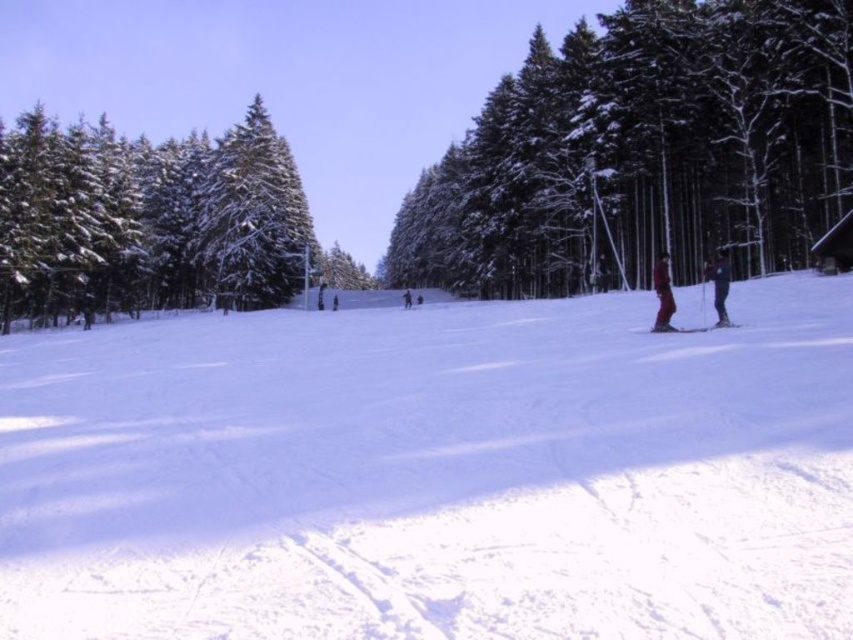
Question: Among these points, which one is farthest from the camera?

Choices:
 (A) (152, 564)
 (B) (724, 312)
 (C) (659, 269)

Answer: (C)

Question: Considering the real-world distances, which object is farthest from the white powdery snow at center?

Choices:
 (A) matte black ski at center
 (B) dark blue ski pants at center
 (C) red fabric skier at right

Answer: (B)

Question: Is green textured pine trees at center to the left of matte black ski at center from the viewer's perspective?

Choices:
 (A) no
 (B) yes

Answer: (B)

Question: Which of these objects is positioned closest to the dark blue ski pants at right?

Choices:
 (A) matte black ski at center
 (B) white powdery snow at center
 (C) dark blue ski pants at center

Answer: (A)

Question: Does white powdery snow at center have a smaller size compared to green textured pine trees at center?

Choices:
 (A) yes
 (B) no

Answer: (A)

Question: Can you confirm if snow-covered evergreen trees at center is positioned above red fabric skier at right?

Choices:
 (A) no
 (B) yes

Answer: (B)